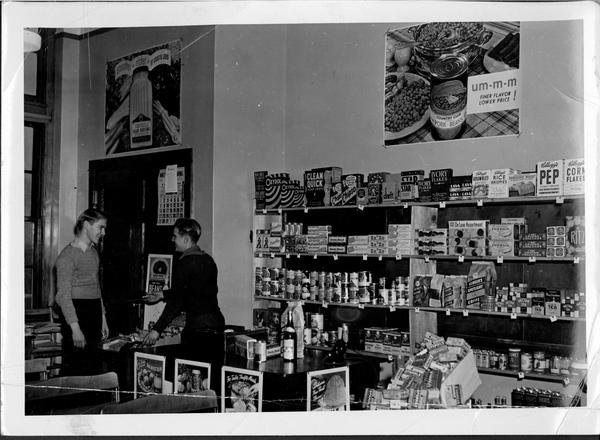
The height and width of the screenshot is (440, 600). Identify the location of pictures. (140, 371).